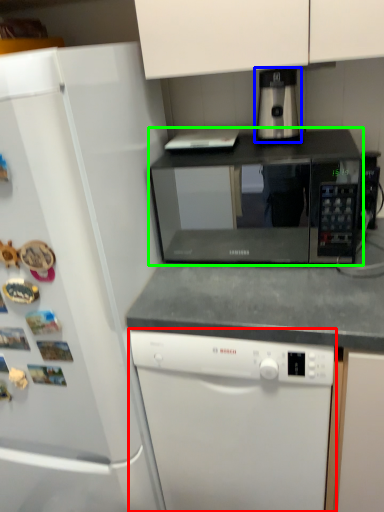
Question: Considering the real-world distances, which object is closest to dishwasher (highlighted by a red box)? coffee machine (highlighted by a blue box) or microwave oven (highlighted by a green box).

Choices:
 (A) coffee machine
 (B) microwave oven

Answer: (A)